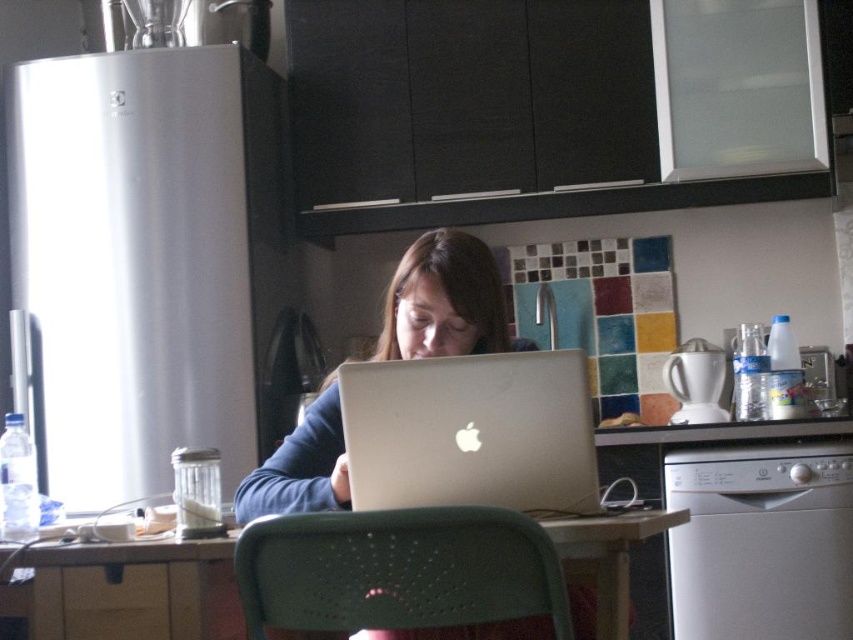
Question: Which is nearer to the green perforated chair at center?

Choices:
 (A) silver metallic laptop at center
 (B) wooden table at center
 (C) matte silver laptop at center

Answer: (A)

Question: Estimate the real-world distances between objects in this image. Which object is closer to the wooden table at center?

Choices:
 (A) matte silver laptop at center
 (B) silver metallic laptop at center
 (C) green perforated chair at center

Answer: (C)

Question: Which object appears closest to the camera in this image?

Choices:
 (A) wooden table at center
 (B) matte silver laptop at center
 (C) silver metallic laptop at center
 (D) green perforated chair at center

Answer: (D)

Question: Does wooden table at center appear on the right side of matte silver laptop at center?

Choices:
 (A) no
 (B) yes

Answer: (A)

Question: Is green perforated chair at center positioned in front of wooden table at center?

Choices:
 (A) no
 (B) yes

Answer: (B)

Question: From the image, what is the correct spatial relationship of silver metallic laptop at center in relation to green perforated chair at center?

Choices:
 (A) left
 (B) right

Answer: (B)